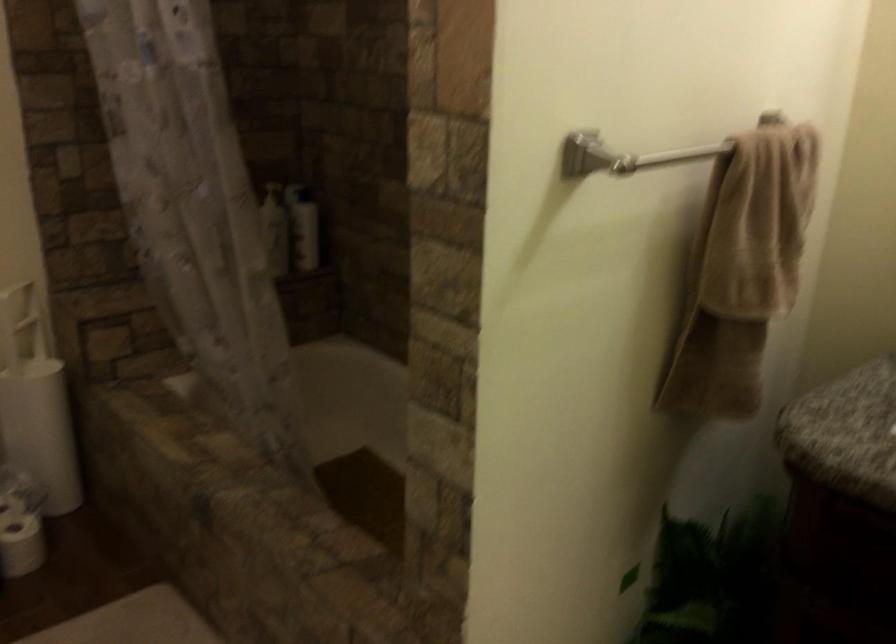
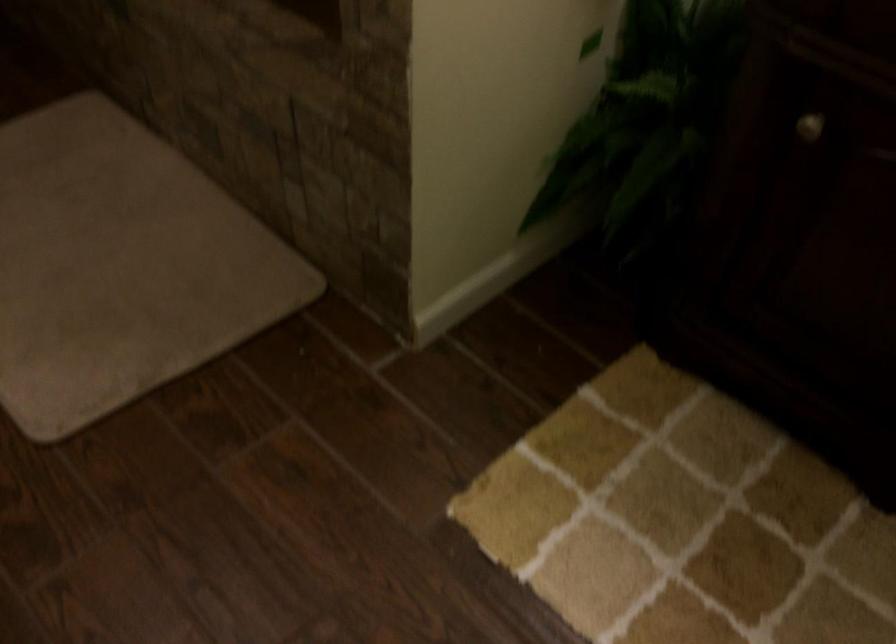
Question: What movement of the cameraman would produce the second image?

Choices:
 (A) Left
 (B) Right
 (C) Forward
 (D) Backward

Answer: (C)